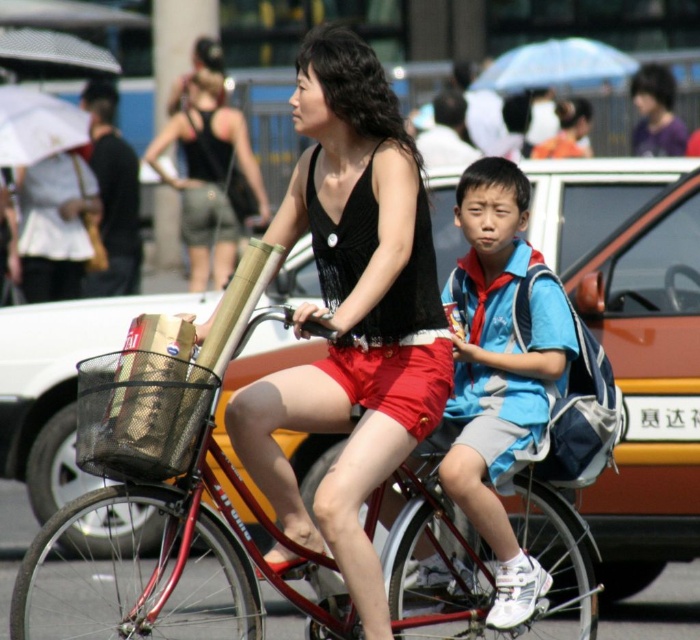
Which is in front, point (351, 52) or point (512, 288)?

Point (351, 52)

Does black matte tank top at center lie in front of blue fabric backpack at center?

Yes, it is in front of blue fabric backpack at center.

The width and height of the screenshot is (700, 640). What do you see at coordinates (351, 310) in the screenshot? I see `black matte tank top at center` at bounding box center [351, 310].

Where is `black matte tank top at center`? This screenshot has height=640, width=700. black matte tank top at center is located at coordinates (351, 310).

Can you confirm if metallic red bicycle at center is bigger than metallic pole at upper center?

Correct, metallic red bicycle at center is larger in size than metallic pole at upper center.

Does metallic red bicycle at center have a greater height compared to metallic pole at upper center?

Correct, metallic red bicycle at center is much taller as metallic pole at upper center.

Is point (568, 513) closer to viewer compared to point (217, 26)?

Yes, point (568, 513) is in front of point (217, 26).

Identify the location of metallic red bicycle at center. The height and width of the screenshot is (640, 700). (144, 522).

Based on the photo, between blue fabric backpack at center and metallic pole at upper center, which one has more height?

Standing taller between the two is blue fabric backpack at center.

Can you confirm if blue fabric backpack at center is smaller than metallic pole at upper center?

Actually, blue fabric backpack at center might be larger than metallic pole at upper center.

Is point (472, 292) positioned before point (155, 259)?

That is True.

Find the location of a particular element. The width and height of the screenshot is (700, 640). blue fabric backpack at center is located at coordinates (498, 372).